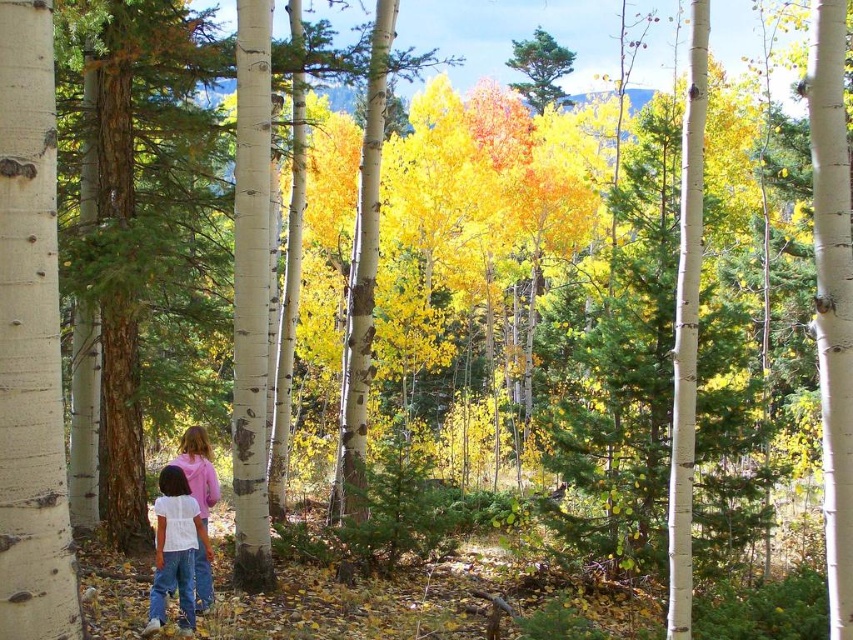
Question: Can you confirm if white cotton shirt at lower center is wider than white cotton shirt at center?

Choices:
 (A) yes
 (B) no

Answer: (B)

Question: Which point is closer to the camera?

Choices:
 (A) (169, 572)
 (B) (198, 602)

Answer: (A)

Question: Is white cotton shirt at lower center to the right of white cotton shirt at center from the viewer's perspective?

Choices:
 (A) yes
 (B) no

Answer: (A)

Question: Does white cotton shirt at lower center come behind white cotton shirt at center?

Choices:
 (A) no
 (B) yes

Answer: (A)

Question: Which of the following is the farthest from the observer?

Choices:
 (A) white cotton shirt at lower center
 (B) white cotton shirt at center

Answer: (B)

Question: Which point is closer to the camera taking this photo?

Choices:
 (A) (213, 502)
 (B) (166, 529)

Answer: (B)